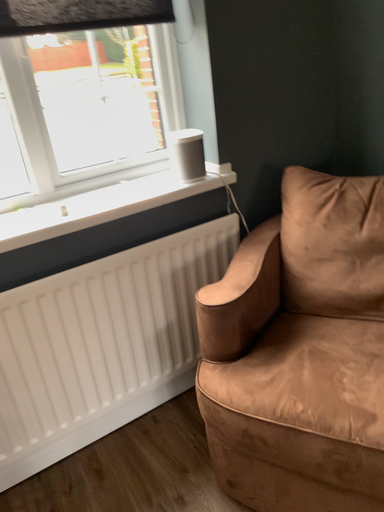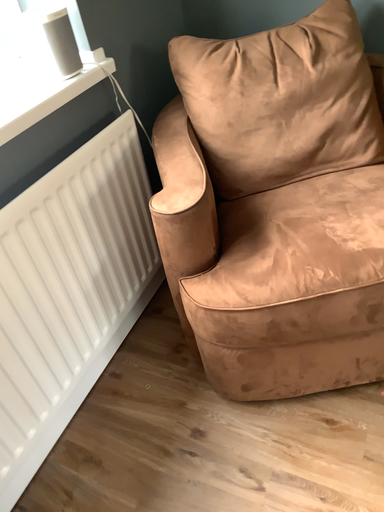
Question: How did the camera likely rotate when shooting the video?

Choices:
 (A) rotated right
 (B) rotated left

Answer: (A)